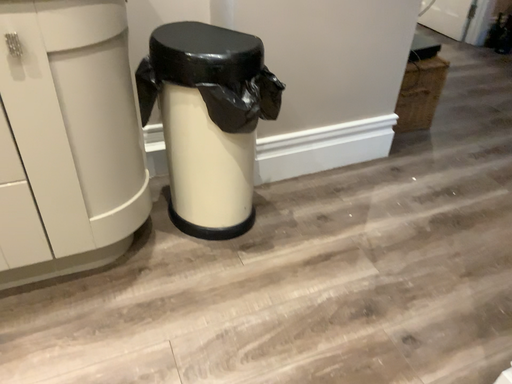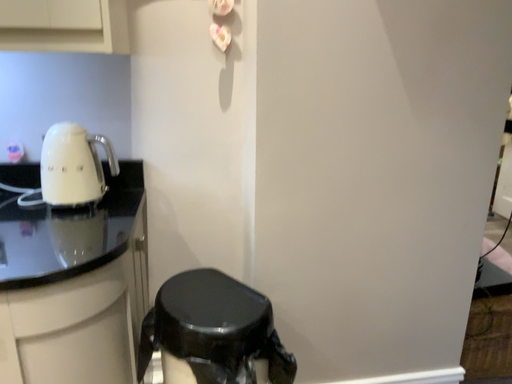
Question: Which way did the camera rotate in the video?

Choices:
 (A) rotated left
 (B) rotated right

Answer: (A)